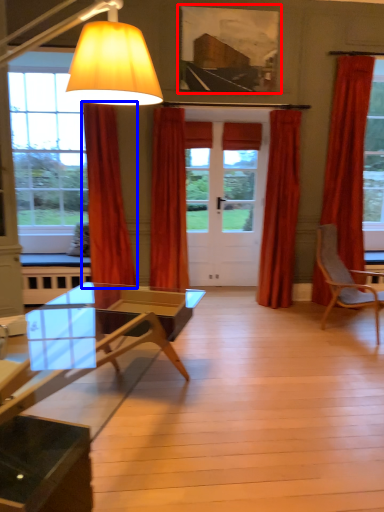
Question: Which point is closer to the camera, picture frame (highlighted by a red box) or curtain (highlighted by a blue box)?

Choices:
 (A) picture frame
 (B) curtain

Answer: (B)